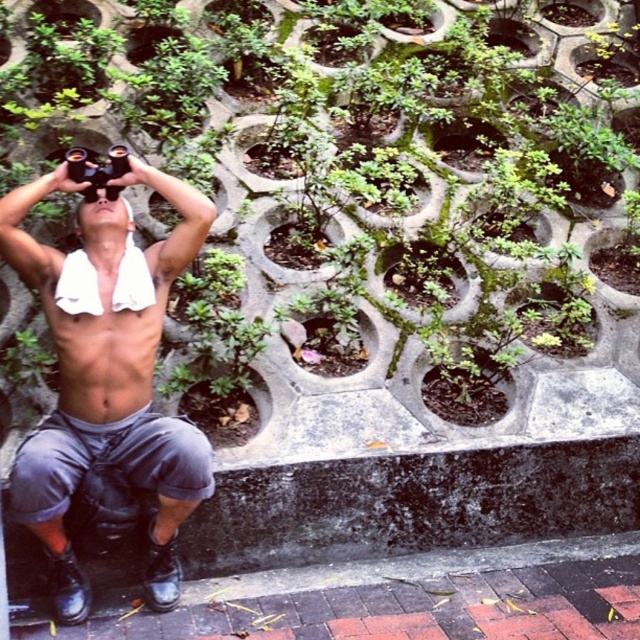
You are a photographer trying to capture the shiny black binoculars at upper center and the green leafy plant at center in a single frame. Which object will appear bigger in your photo?

The green leafy plant at center will appear bigger in the photo because it is larger in size than the shiny black binoculars at upper center.

You are standing in front of the wall with plants and want to place a small statue between the green leafy plant at center and the shiny black binoculars at upper center. Based on their positions, where should you place the statue?

The green leafy plant at center is positioned over the shiny black binoculars at upper center, so to place the statue between them, it should be placed below the green leafy plant at center and above the shiny black binoculars at upper center.